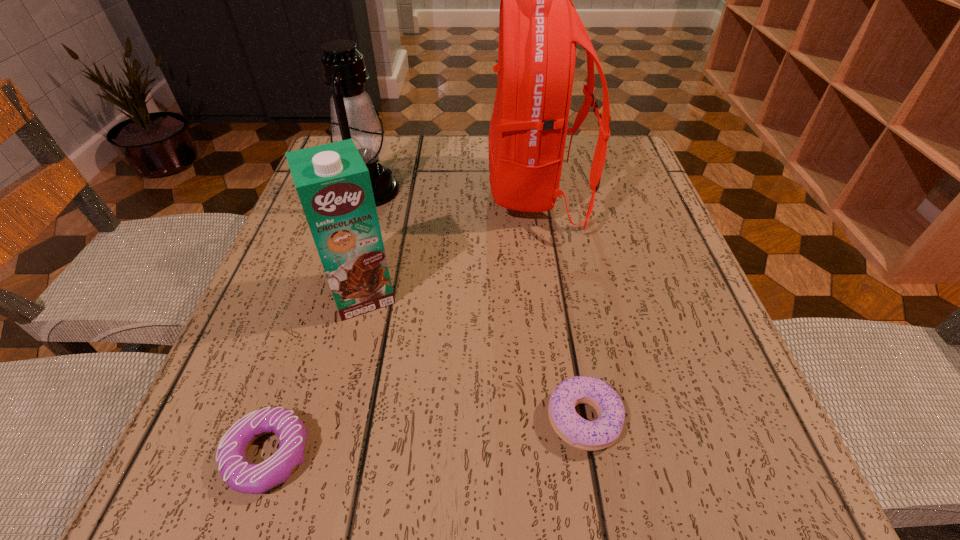
The image size is (960, 540). Find the location of `backpack`. backpack is located at coordinates (539, 26).

Where is `oil lamp`? oil lamp is located at coordinates click(x=353, y=115).

Where is `carton`? carton is located at coordinates (333, 183).

Identify the location of the right doughnut. The height and width of the screenshot is (540, 960). (599, 434).

Locate an element on the screen. the left doughnut is located at coordinates (240, 475).

Where is `free point located 0.400m on the main compartment of the tallest object`? The height and width of the screenshot is (540, 960). free point located 0.400m on the main compartment of the tallest object is located at coordinates (304, 192).

Where is `vacant space positioned on the main compartment of the tallest object`? vacant space positioned on the main compartment of the tallest object is located at coordinates (461, 192).

This screenshot has width=960, height=540. I want to click on free point located 0.170m on the main compartment of the tallest object, so click(410, 192).

Image resolution: width=960 pixels, height=540 pixels. What are the coordinates of `blank area located 0.250m on the front of the oil lamp` in the screenshot? It's located at click(x=335, y=305).

The image size is (960, 540). Identify the location of vacant space located 0.210m on the back of the carton. (386, 200).